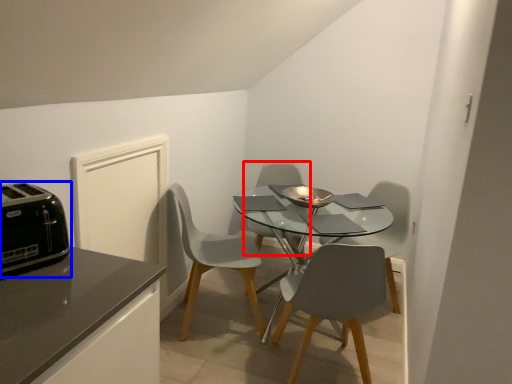
Question: Which point is closer to the camera, chair (highlighted by a red box) or toaster (highlighted by a blue box)?

Choices:
 (A) chair
 (B) toaster

Answer: (B)